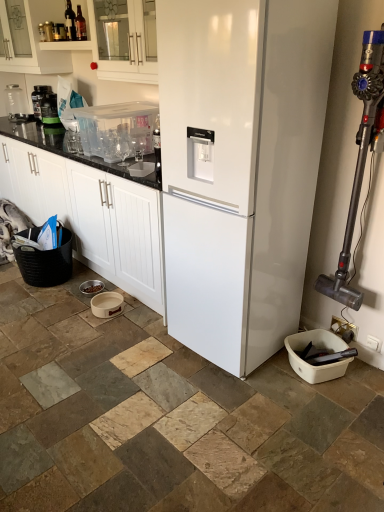
Question: Which is correct: clear plastic container at upper left, marked as the 7th appliance in a front-to-back arrangement, is inside dark glass bottle at upper left, or outside of it?

Choices:
 (A) outside
 (B) inside

Answer: (A)

Question: From the image's perspective, is clear plastic container at upper left, acting as the seventh appliance starting from the right, above or below dark glass bottle at upper left?

Choices:
 (A) above
 (B) below

Answer: (B)

Question: Which object is the closest to the white plastic bucket at lower right, positioned as the 2th appliance in front-to-back order?

Choices:
 (A) white glossy refrigerator at center
 (B) white glossy cabinet at upper center, the second cabinetry positioned from the top
 (C) clear plastic container at upper left, acting as the seventh appliance starting from the right
 (D) beige ceramic bowl at lower center, which ranks as the 4th appliance in left-to-right order
 (E) matte black protein powder container at upper left, which appears as the sixth appliance when viewed from the front

Answer: (A)

Question: Estimate the real-world distances between objects in this image. Which object is closer to the clear plastic container at upper left, which is the 1th appliance in back-to-front order?

Choices:
 (A) metallic gray vacuum cleaner at right, the 1th appliance in the front-to-back sequence
 (B) white glossy cabinet at upper center, arranged as the 2th cabinetry when ordered from the bottom
 (C) white plastic bucket at lower right, positioned as the 2th appliance in front-to-back order
 (D) beige ceramic bowl at lower center, which is the fourth appliance in right-to-left order
 (E) black woven basket at lower left

Answer: (B)